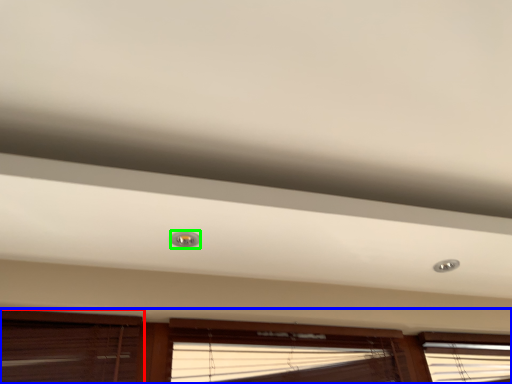
Question: Which is farther away from window (highlighted by a red box)? window (highlighted by a blue box) or droplight (highlighted by a green box)?

Choices:
 (A) window
 (B) droplight

Answer: (B)